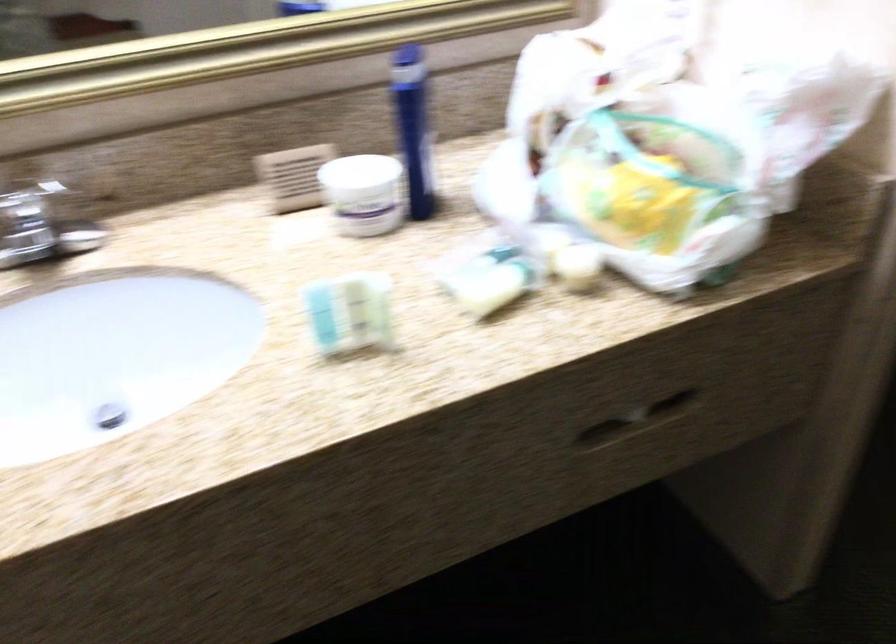
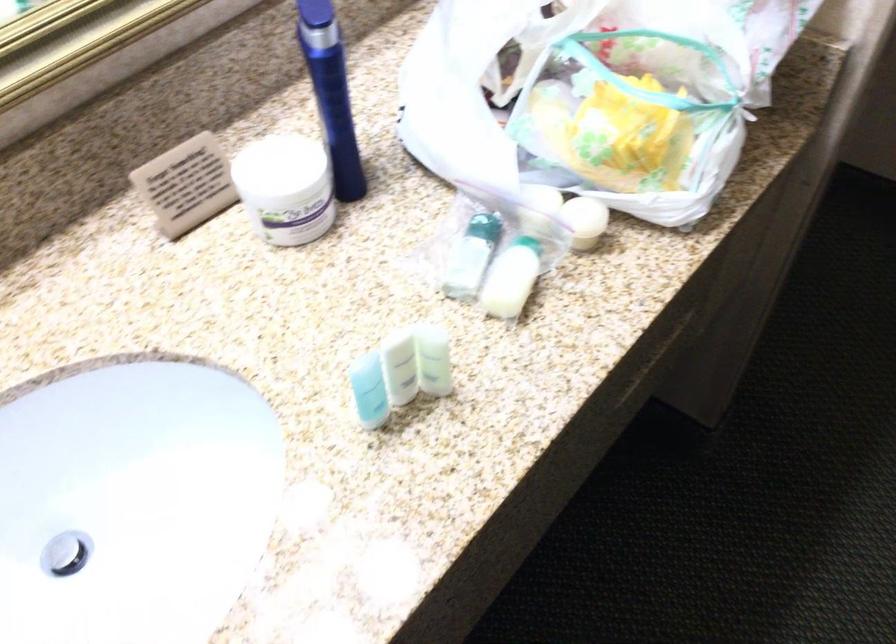
Locate, in the second image, the point that corresponds to pixel 355 182 in the first image.

(286, 187)